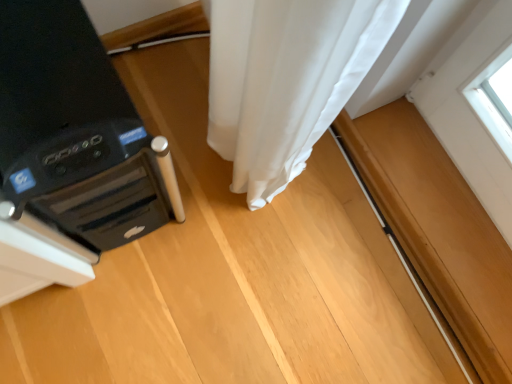
This screenshot has width=512, height=384. In order to click on black plastic speaker at left in this screenshot , I will do `click(75, 133)`.

The image size is (512, 384). What do you see at coordinates (75, 133) in the screenshot?
I see `black plastic speaker at left` at bounding box center [75, 133].

Find the location of `black plastic speaker at left`. black plastic speaker at left is located at coordinates (75, 133).